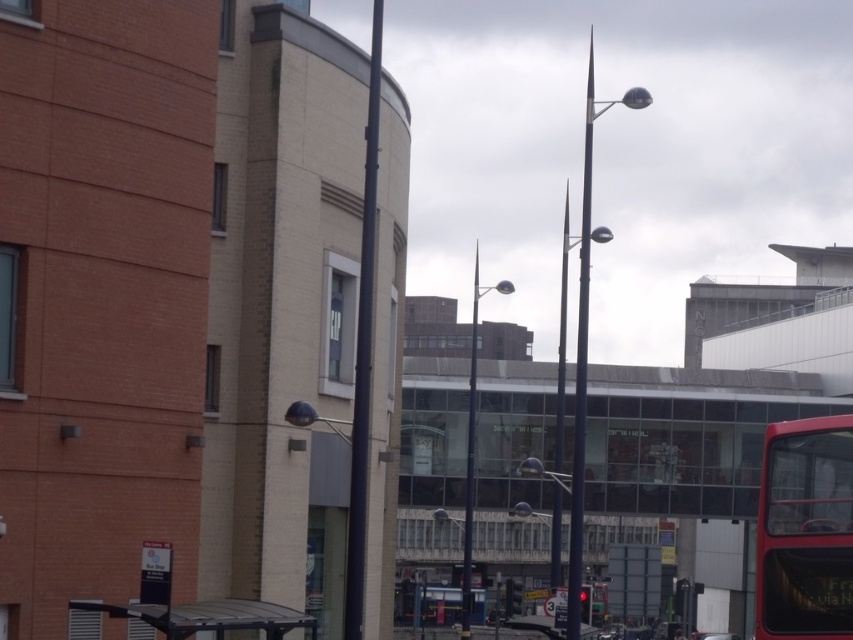
Does point (840, 464) come in front of point (199, 612)?

Yes, point (840, 464) is in front of point (199, 612).

Which is in front, point (817, 552) or point (175, 616)?

Point (817, 552) is in front.

Is point (833, 605) less distant than point (271, 632)?

That is True.

Locate an element on the screen. The width and height of the screenshot is (853, 640). red matte bus at right is located at coordinates (805, 531).